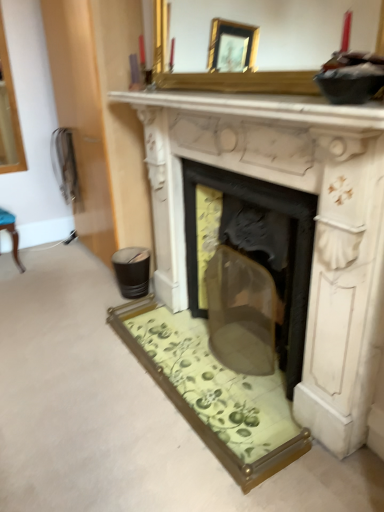
Question: Considering the relative sizes of white marble fireplace at center and white marble fireplace at upper center in the image provided, is white marble fireplace at center taller than white marble fireplace at upper center?

Choices:
 (A) yes
 (B) no

Answer: (A)

Question: Considering the relative positions of white marble fireplace at center and white marble fireplace at upper center in the image provided, is white marble fireplace at center to the right of white marble fireplace at upper center from the viewer's perspective?

Choices:
 (A) no
 (B) yes

Answer: (B)

Question: From a real-world perspective, is white marble fireplace at center positioned under white marble fireplace at upper center based on gravity?

Choices:
 (A) yes
 (B) no

Answer: (A)

Question: Is the position of white marble fireplace at center more distant than that of white marble fireplace at upper center?

Choices:
 (A) yes
 (B) no

Answer: (A)

Question: Does white marble fireplace at center have a larger size compared to white marble fireplace at upper center?

Choices:
 (A) no
 (B) yes

Answer: (B)

Question: Is white marble fireplace at center wider or thinner than white marble fireplace at upper center?

Choices:
 (A) thin
 (B) wide

Answer: (B)

Question: From a real-world perspective, is white marble fireplace at center physically located above or below white marble fireplace at upper center?

Choices:
 (A) above
 (B) below

Answer: (B)

Question: Do you think white marble fireplace at center is within white marble fireplace at upper center, or outside of it?

Choices:
 (A) inside
 (B) outside

Answer: (B)

Question: Is point (158, 128) closer or farther from the camera than point (360, 129)?

Choices:
 (A) closer
 (B) farther

Answer: (B)

Question: Visually, is gold-framed mirror at upper center positioned to the left or to the right of white marble fireplace at upper center?

Choices:
 (A) left
 (B) right

Answer: (B)

Question: Does point (382, 79) appear closer or farther from the camera than point (278, 102)?

Choices:
 (A) closer
 (B) farther

Answer: (A)

Question: Is gold-framed mirror at upper center bigger or smaller than white marble fireplace at upper center?

Choices:
 (A) small
 (B) big

Answer: (B)

Question: Considering their positions, is gold-framed mirror at upper center located in front of or behind white marble fireplace at upper center?

Choices:
 (A) behind
 (B) front

Answer: (A)

Question: Considering the positions of point (340, 387) and point (162, 70), is point (340, 387) closer or farther from the camera than point (162, 70)?

Choices:
 (A) farther
 (B) closer

Answer: (B)

Question: Which is correct: white marble fireplace at center is inside gold-framed mirror at upper center, or outside of it?

Choices:
 (A) inside
 (B) outside

Answer: (B)